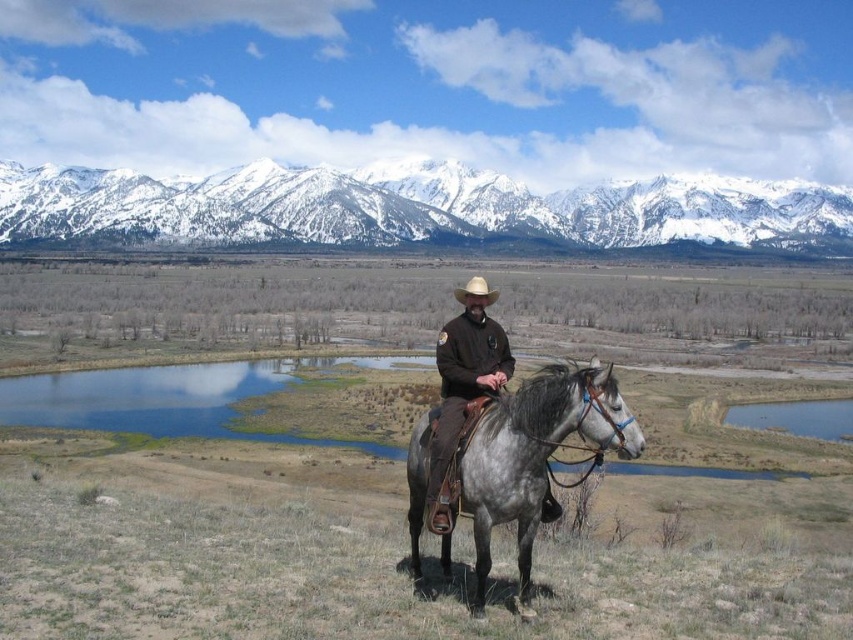
You are standing in the middle of the field in the image and want to walk towards the point that is closer to you. Which point should you head towards, point (370, 209) or point (450, 320)?

Point (450, 320) is closer to you because it is less further to the camera than point (370, 209).

You are a photographer trying to capture a wide shot of the gray leather horse at center and the brown leather jacket at center in the landscape. If your camera has a maximum focus range of 10 meters, will you be able to capture both subjects clearly in one frame?

The distance between the gray leather horse at center and the brown leather jacket at center is 8.04 meters. Since the camera can focus up to 10 meters, both subjects are within the focus range and can be captured clearly in one frame.

You are a photographer positioned behind the gray leather horse at center and the brown felt cowboy hat at center. Which object is closer to your camera lens?

The gray leather horse at center is closer to the camera lens because it is positioned in front of the brown felt cowboy hat at center.